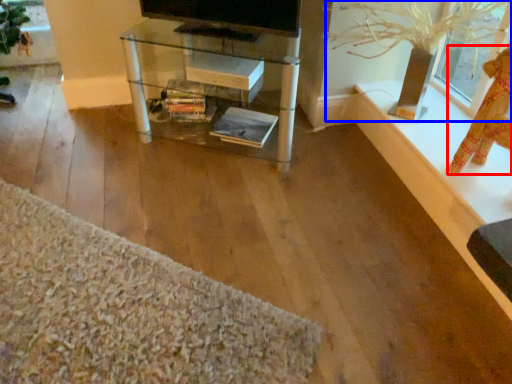
Question: Which object appears farthest to the camera in this image, doll (highlighted by a red box) or plant (highlighted by a blue box)?

Choices:
 (A) doll
 (B) plant

Answer: (B)